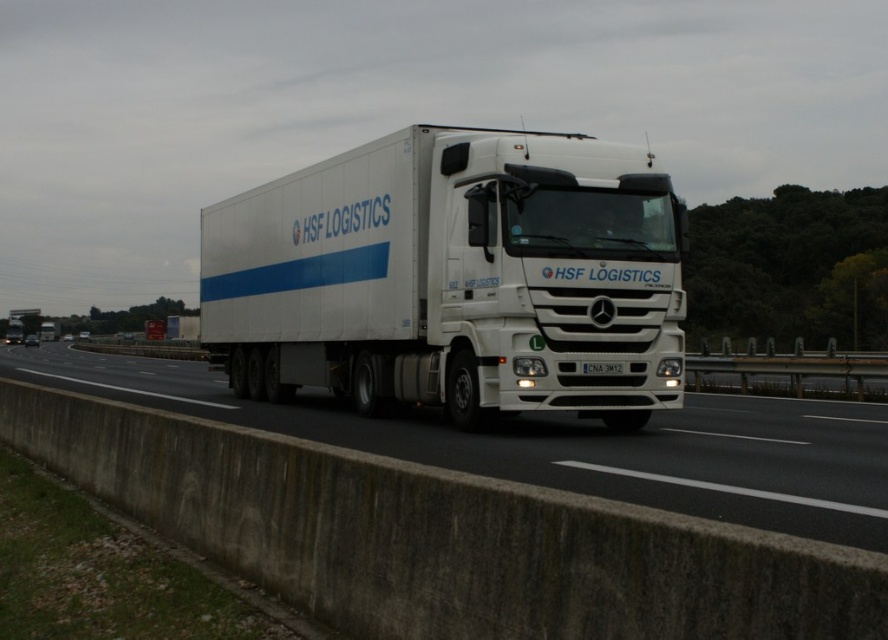
Question: Which of the following is the farthest from the observer?

Choices:
 (A) white plastic license plate at center
 (B) white concrete barrier at lower center

Answer: (A)

Question: Which point is closer to the camera?

Choices:
 (A) white plastic license plate at center
 (B) white concrete barrier at lower center

Answer: (B)

Question: Which object is the closest to the white glossy truck at center?

Choices:
 (A) white plastic license plate at center
 (B) white concrete barrier at lower center

Answer: (A)

Question: Is white glossy truck at center smaller than white plastic license plate at center?

Choices:
 (A) yes
 (B) no

Answer: (B)

Question: Does white glossy truck at center come behind white concrete barrier at lower center?

Choices:
 (A) yes
 (B) no

Answer: (A)

Question: Considering the relative positions of white glossy truck at center and white concrete barrier at lower center in the image provided, where is white glossy truck at center located with respect to white concrete barrier at lower center?

Choices:
 (A) left
 (B) right

Answer: (B)